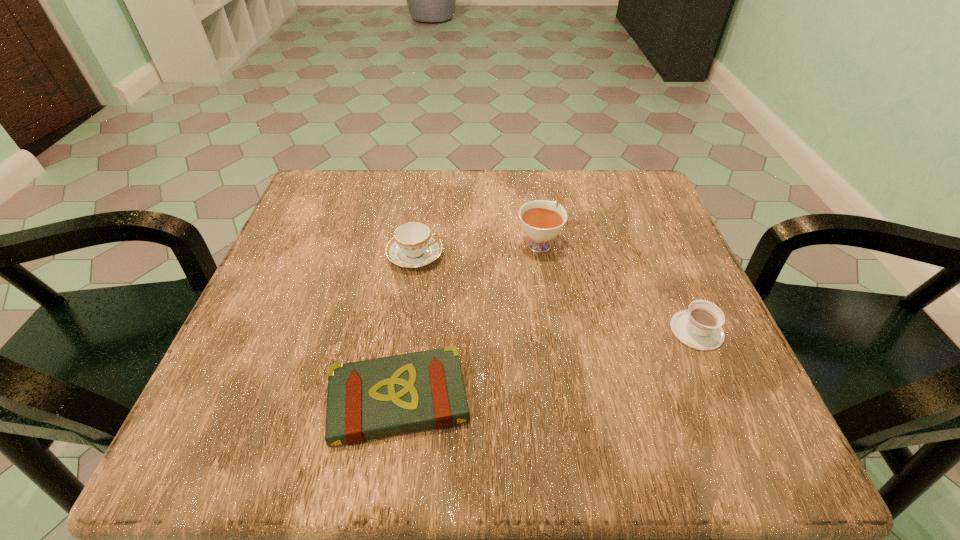
Where is `vacant region located 0.120m on the side of the third object from left to right with the handle`? This screenshot has height=540, width=960. vacant region located 0.120m on the side of the third object from left to right with the handle is located at coordinates (532, 195).

Image resolution: width=960 pixels, height=540 pixels. What are the coordinates of `vacant space positioned on the side with the handle of the second tallest teacup` in the screenshot? It's located at (614, 255).

Find the location of `free space located 0.260m on the handle side of the rightmost object`. free space located 0.260m on the handle side of the rightmost object is located at coordinates (649, 222).

Identify the location of vacant space located on the handle side of the rightmost object. (669, 269).

Where is `free point located 0.370m on the handle side of the rightmost object`? The height and width of the screenshot is (540, 960). free point located 0.370m on the handle side of the rightmost object is located at coordinates (636, 193).

Find the location of a particular element. free space located 0.290m on the back of the nearest object is located at coordinates (421, 242).

The height and width of the screenshot is (540, 960). I want to click on object that is at the far edge, so click(x=541, y=221).

Where is `object situated at the near edge`? The width and height of the screenshot is (960, 540). object situated at the near edge is located at coordinates (370, 399).

I want to click on object present at the right edge, so click(x=699, y=327).

Find the location of a particular element. Image resolution: width=960 pixels, height=540 pixels. vacant space at the far edge of the desktop is located at coordinates (389, 226).